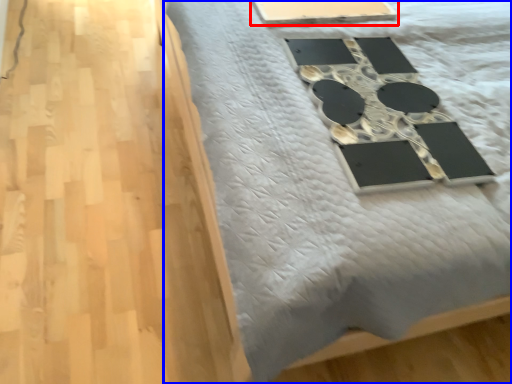
Question: Which of the following is the closest to the observer, table (highlighted by a red box) or furniture (highlighted by a blue box)?

Choices:
 (A) table
 (B) furniture

Answer: (B)